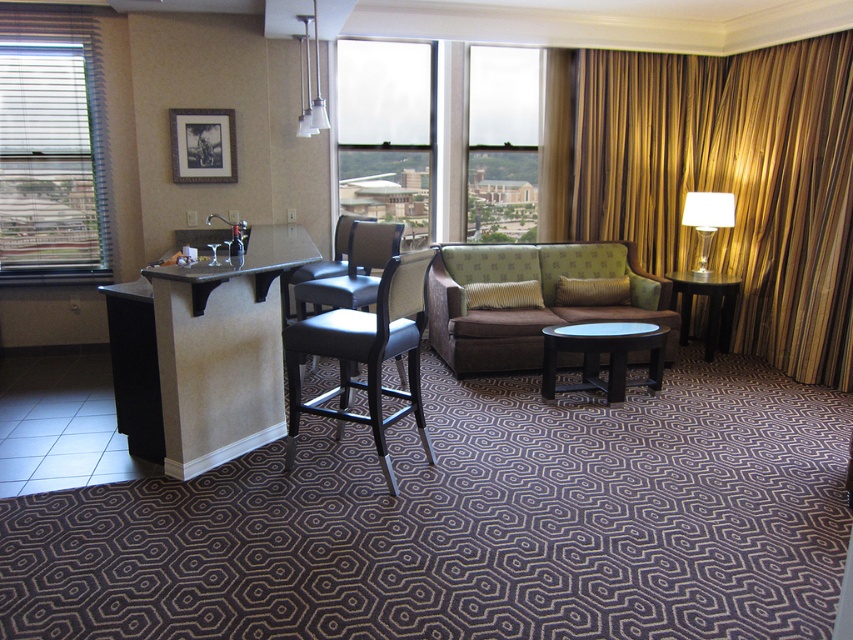
You are a guest in the hotel room and want to locate both the gold striped curtain at right and the white glass lamp at right. According to the scene, which one is positioned more to the east side of the room?

The gold striped curtain at right is positioned to the right of the white glass lamp at right, so the gold striped curtain at right is more to the east side of the room.

You are a guest in this hotel room and want to turn off the white glass lamp at right. However, you notice the gold striped curtain at right is blocking your access to the lamp. Can you reach the lamp without moving the curtain?

The gold striped curtain at right is positioned over the white glass lamp at right, so you cannot reach the lamp without moving the curtain.

You are a guest in the hotel room and want to sit on the leather seat at center. However, you notice the transparent glass windows at center above it. Is there enough space between the windows and the seat for you to sit comfortably?

The transparent glass windows at center is positioned over the leather seat at center, so there is sufficient vertical space between them for you to sit comfortably on the leather seat at center without touching the windows.